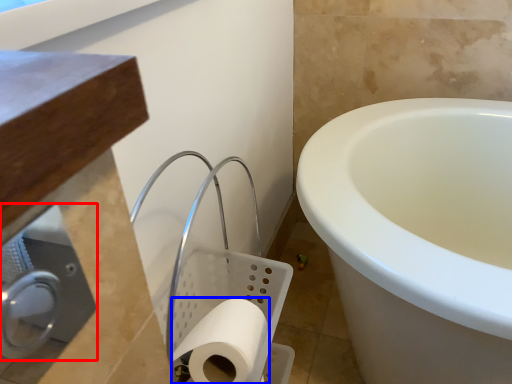
Question: Which object is closer to the camera taking this photo, dispenser (highlighted by a red box) or toilet paper (highlighted by a blue box)?

Choices:
 (A) dispenser
 (B) toilet paper

Answer: (A)